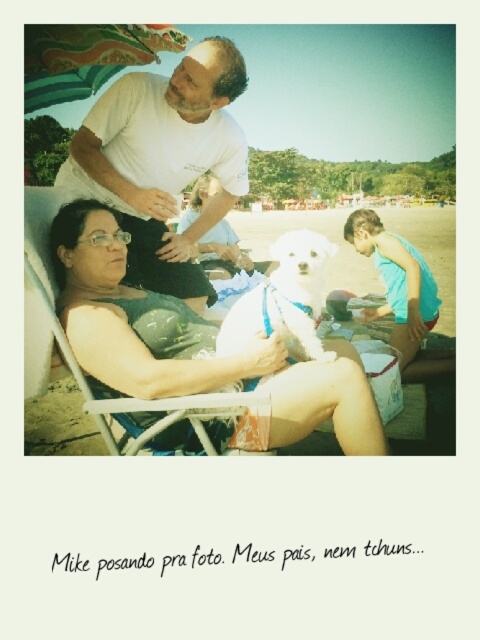
Between point (110, 285) and point (320, 352), which one is positioned behind?

Point (110, 285)

Is point (145, 372) closer to camera compared to point (300, 344)?

Yes.

Does point (116, 250) lie in front of point (314, 308)?

That is False.

Identify the location of matte black swimsuit at center. (191, 342).

Who is more distant from viewer, (305, 378) or (86, 150)?

Positioned behind is point (86, 150).

Who is more distant from viewer, (315, 419) or (240, 76)?

The point (240, 76) is more distant.

At what (x,y) coordinates should I click in order to perform the action: click on matte black swimsuit at center. Please return your answer as a coordinate pair (x, y). Looking at the image, I should click on (191, 342).

Does white matte t-shirt at upper left appear on the right side of white fluffy dog at center?

In fact, white matte t-shirt at upper left is to the left of white fluffy dog at center.

Does white matte t-shirt at upper left have a larger size compared to white fluffy dog at center?

No.

Is point (167, 120) in front of point (291, 236)?

No, (167, 120) is behind (291, 236).

Identify the location of white matte t-shirt at upper left. The height and width of the screenshot is (640, 480). (165, 161).